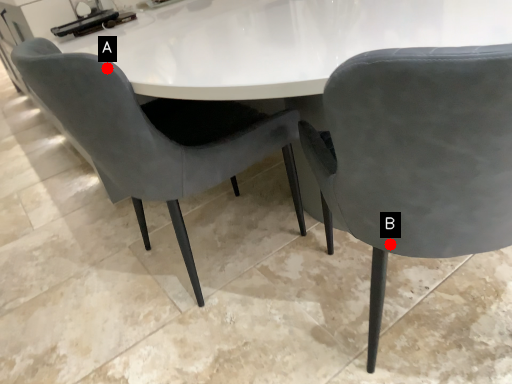
Question: Two points are circled on the image, labeled by A and B beside each circle. Among these points, which one is nearest to the camera?

Choices:
 (A) A is closer
 (B) B is closer

Answer: (B)